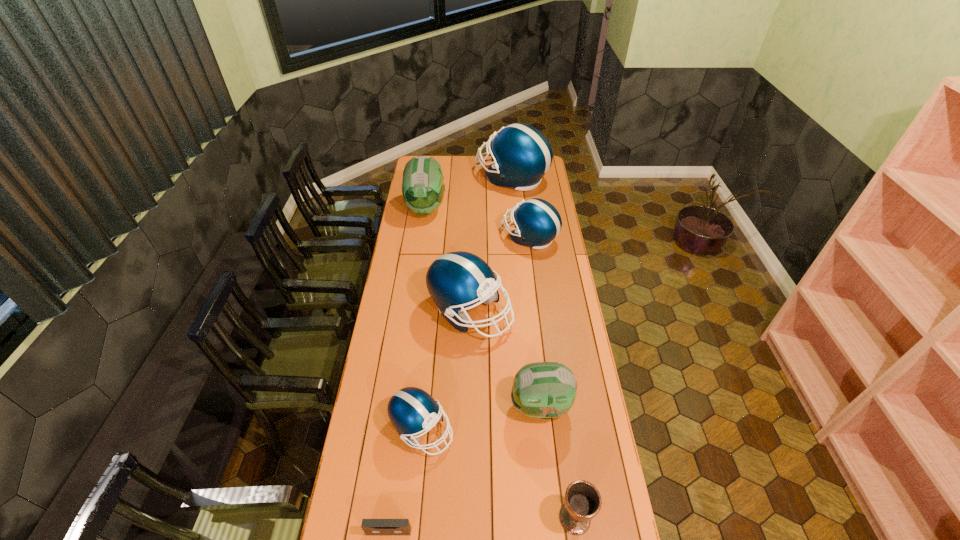
The image size is (960, 540). What are the coordinates of `vacant space at the far edge` in the screenshot? It's located at (444, 167).

Find the location of a particular element. Image resolution: width=960 pixels, height=540 pixels. vacant area at the left edge of the desktop is located at coordinates (411, 241).

Where is `free spot at the right edge of the desktop`? free spot at the right edge of the desktop is located at coordinates (x=542, y=197).

The width and height of the screenshot is (960, 540). Find the location of `vacant space in between the shortest football helmet and the videotape`. vacant space in between the shortest football helmet and the videotape is located at coordinates (405, 481).

In order to click on vacant area between the left green football helmet and the second smallest blue football helmet in this screenshot , I will do `click(477, 222)`.

Where is `free point between the chalice and the nearest blue football helmet`? free point between the chalice and the nearest blue football helmet is located at coordinates (498, 474).

This screenshot has height=540, width=960. Identify the location of vacant area that lies between the farther green football helmet and the smallest blue football helmet. (423, 319).

Locate an element on the screen. Image resolution: width=960 pixels, height=540 pixels. free point between the shortest football helmet and the third nearest football helmet is located at coordinates (446, 371).

I want to click on vacant space in between the nearer green football helmet and the third biggest blue football helmet, so (x=535, y=322).

Image resolution: width=960 pixels, height=540 pixels. Find the location of `free space between the smallest blue football helmet and the bigger green football helmet`. free space between the smallest blue football helmet and the bigger green football helmet is located at coordinates coord(423,319).